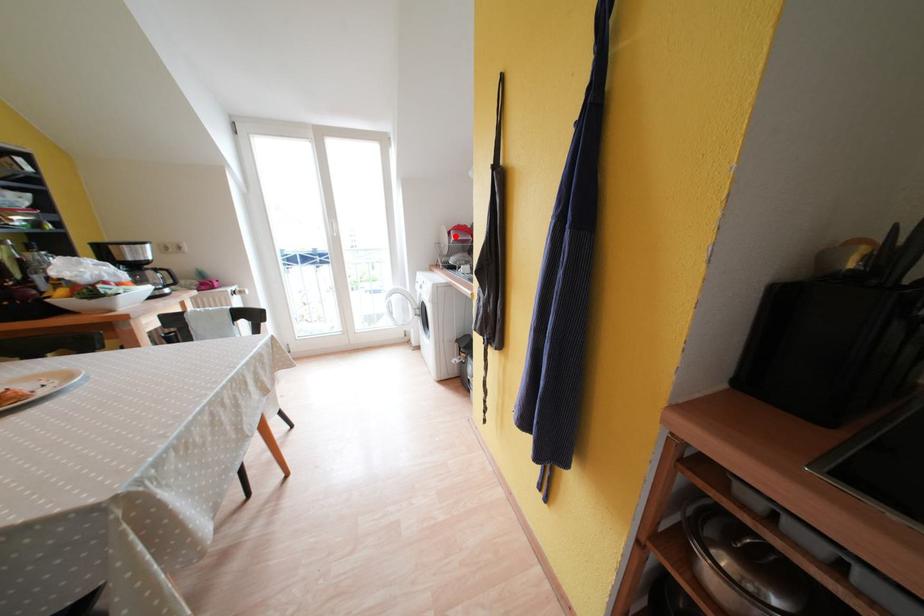
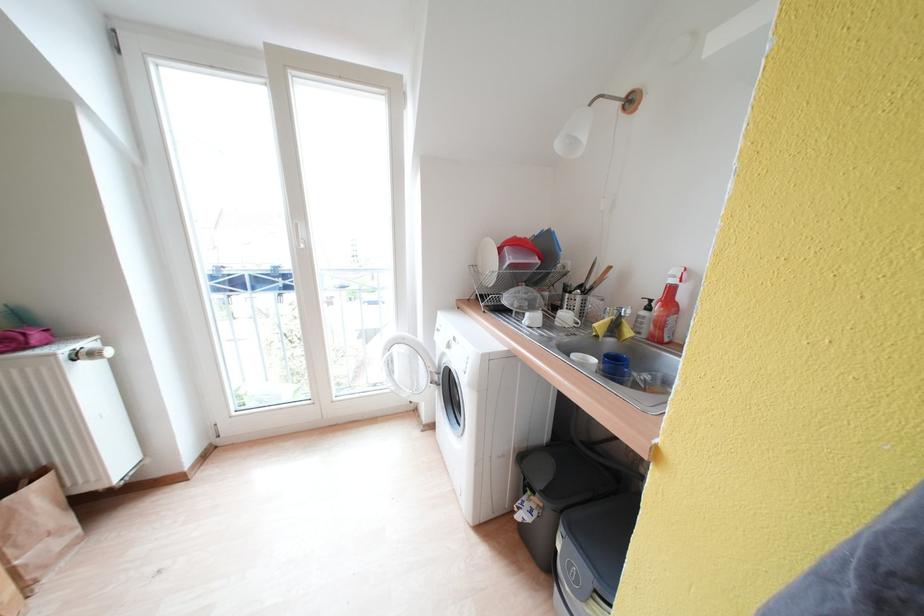
The point at the highlighted location is marked in the first image. Where is the corresponding point in the second image?

(505, 254)